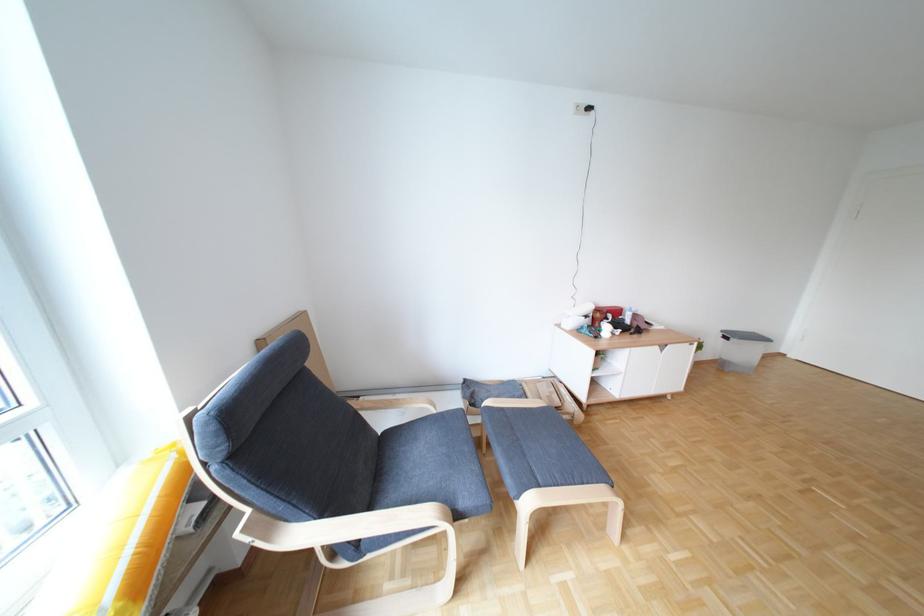
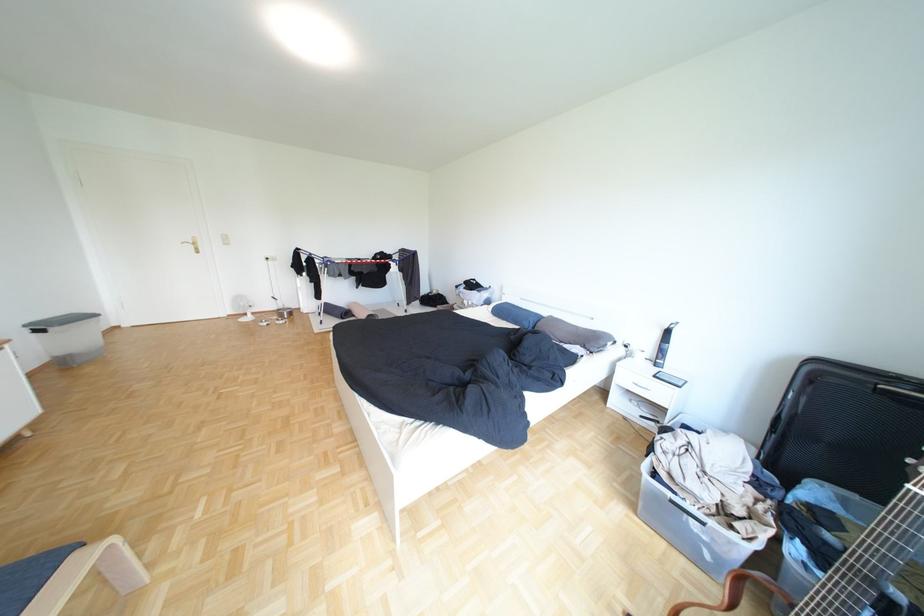
The first image is from the beginning of the video and the second image is from the end. How did the camera likely rotate when shooting the video?

The camera rotated toward right-down.